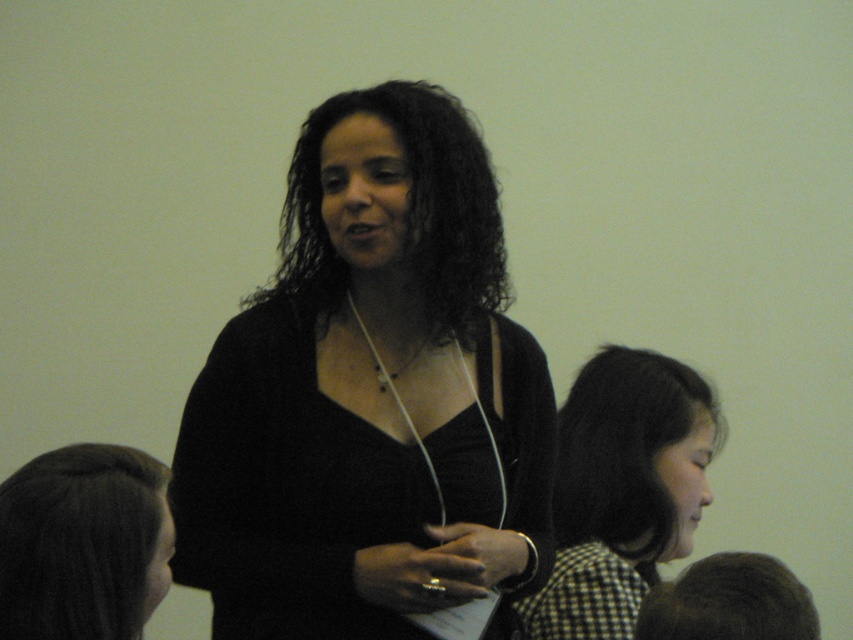
Question: Is dark brown hair at lower left positioned at the back of dark brown hair at lower right?

Choices:
 (A) no
 (B) yes

Answer: (A)

Question: Which of these objects is positioned closest to the checkered fabric shirt at lower right?

Choices:
 (A) dark brown hair at lower left
 (B) dark curly hair at center
 (C) dark brown hair at lower right
 (D) black matte/black fabric at center

Answer: (D)

Question: Can you confirm if checkered fabric shirt at lower right is positioned to the right of dark curly hair at center?

Choices:
 (A) yes
 (B) no

Answer: (A)

Question: Which of the following is the farthest from the observer?

Choices:
 (A) (656, 572)
 (B) (10, 570)

Answer: (A)

Question: Among these points, which one is nearest to the camera?

Choices:
 (A) (376, 563)
 (B) (691, 600)

Answer: (B)

Question: Does dark brown hair at lower left appear on the right side of dark brown hair at lower right?

Choices:
 (A) yes
 (B) no

Answer: (B)